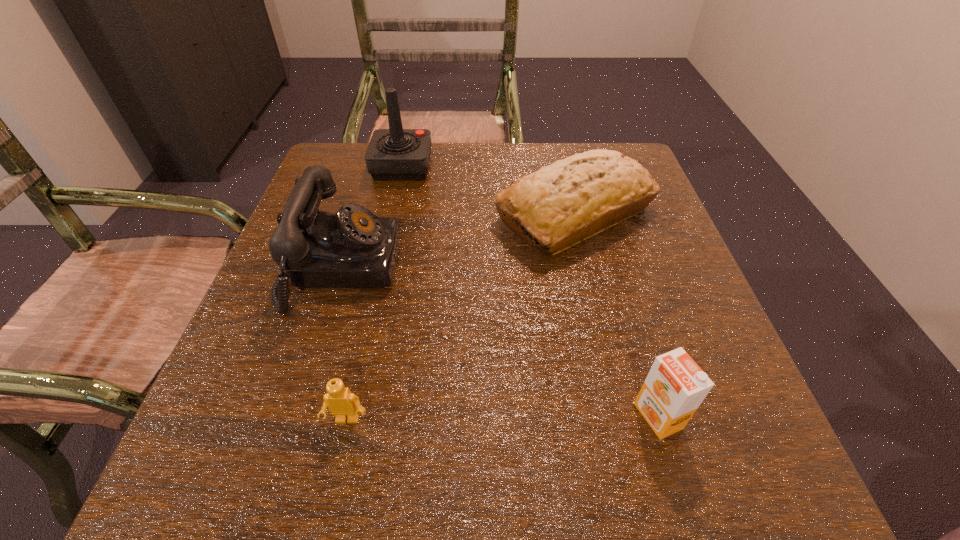
Locate an element on the screen. joystick is located at coordinates point(393,154).

Identify the location of telephone. The width and height of the screenshot is (960, 540). (353, 248).

You are a GUI agent. You are given a task and a screenshot of the screen. Output one action in this format:
    pyautogui.click(x=<x>, y=<y>)
    Task: Click on the bread
    The image size is (960, 540).
    Given the screenshot: What is the action you would take?
    pyautogui.click(x=580, y=196)

Find the location of a particular element. Image resolution: width=960 pixels, height=540 pixels. orange juice is located at coordinates (675, 386).

The image size is (960, 540). Identify the location of Lego. (342, 403).

You are a GUI agent. You are given a task and a screenshot of the screen. Output one action in this format:
    pyautogui.click(x=<x>, y=<y>)
    Task: Click on the vacant space located 0.320m on the front-facing side of the joystick
    This screenshot has height=540, width=960.
    Given the screenshot: What is the action you would take?
    pyautogui.click(x=558, y=166)

This screenshot has width=960, height=540. I want to click on free space located on the dial of the telephone, so click(x=433, y=268).

I want to click on vacant space located on the front of the bread, so click(624, 418).

Locate an element on the screen. This screenshot has height=540, width=960. vacant space located 0.330m on the left of the orange juice is located at coordinates (411, 416).

This screenshot has height=540, width=960. I want to click on joystick that is at the far edge, so click(393, 154).